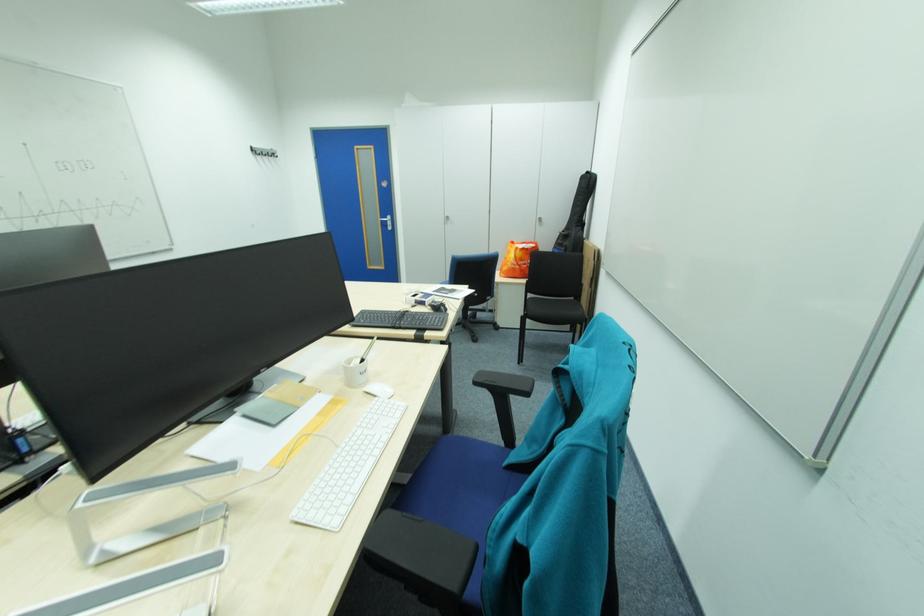
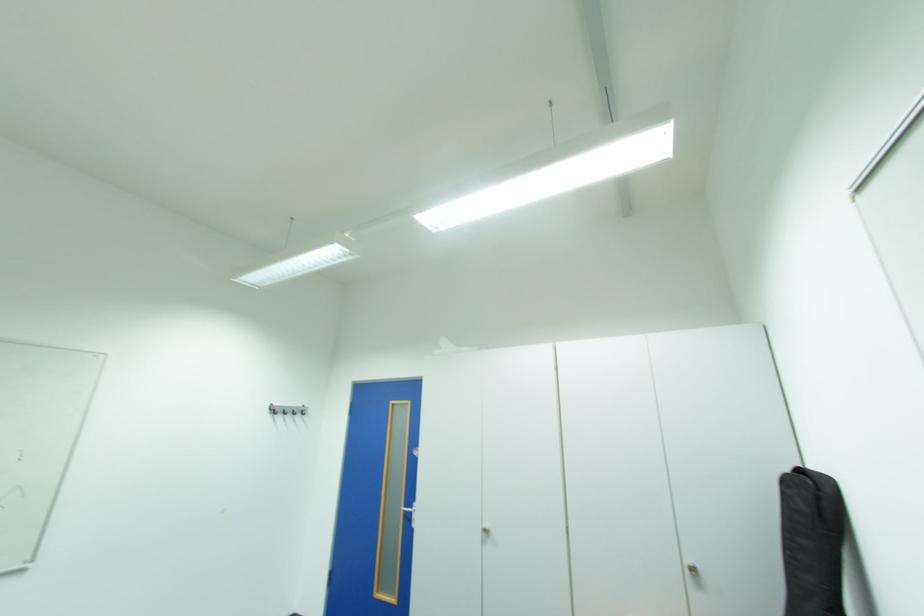
Find the pixel in the second image that matches (546,220) in the first image.

(697, 570)